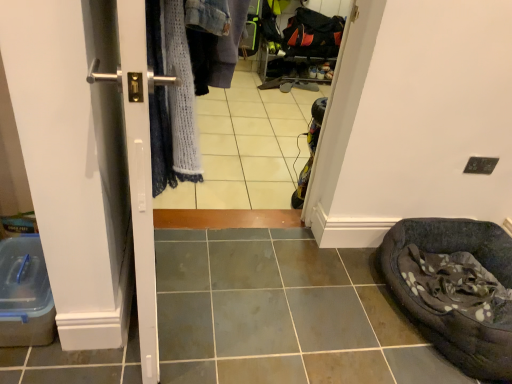
What are the coordinates of `white glossy tile at center` in the screenshot? It's located at (245, 147).

What is the approximate height of satin silver handle at left?

satin silver handle at left is 1.15 meters in height.

Locate an element on the screen. The image size is (512, 384). white glossy tile at center is located at coordinates (245, 147).

Based on the photo, is satin silver handle at left in front of white glossy tile at center?

Yes, the depth of satin silver handle at left is less than that of white glossy tile at center.

Which object is positioned more to the left, satin silver handle at left or white glossy tile at center?

satin silver handle at left.

Would you say white glossy tile at center is part of satin silver handle at left's contents?

That's incorrect, white glossy tile at center is not inside satin silver handle at left.

Considering the sizes of objects satin silver handle at left and white glossy tile at center in the image provided, who is smaller, satin silver handle at left or white glossy tile at center?

white glossy tile at center.

Is white glossy tile at center wider or thinner than satin silver handle at left?

In the image, white glossy tile at center appears to be wider than satin silver handle at left.

Is white glossy tile at center at the left side of satin silver handle at left?

No.

Does point (222, 137) lie in front of point (125, 91)?

No, (222, 137) is further to viewer.

Can you tell me how much white glossy tile at center and satin silver handle at left differ in facing direction?

There is a 0.00164-degree angle between the facing directions of white glossy tile at center and satin silver handle at left.

How different are the orientations of dark gray fabric bean bag at lower right and white glossy tile at center in degrees?

174 degrees.

Does dark gray fabric bean bag at lower right turn towards white glossy tile at center?

No, dark gray fabric bean bag at lower right is not facing towards white glossy tile at center.

From the image's perspective, which one is positioned higher, dark gray fabric bean bag at lower right or white glossy tile at center?

From the image's view, white glossy tile at center is above.

Based on the photo, considering the relative sizes of dark gray fabric bean bag at lower right and white glossy tile at center in the image provided, is dark gray fabric bean bag at lower right shorter than white glossy tile at center?

Correct, dark gray fabric bean bag at lower right is not as tall as white glossy tile at center.

The image size is (512, 384). There is a dark gray fabric bean bag at lower right. Identify the location of screen door above it (from a real-world perspective). (138, 166).

Who is more distant, dark gray fabric bean bag at lower right or satin silver handle at left?

dark gray fabric bean bag at lower right is further away from the camera.

Which of these two, dark gray fabric bean bag at lower right or satin silver handle at left, is smaller?

dark gray fabric bean bag at lower right.

Is dark gray fabric bean bag at lower right at the right side of satin silver handle at left?

Indeed, dark gray fabric bean bag at lower right is positioned on the right side of satin silver handle at left.

Considering the sizes of white glossy tile at center and dark gray fabric bean bag at lower right in the image, is white glossy tile at center taller or shorter than dark gray fabric bean bag at lower right?

white glossy tile at center is taller than dark gray fabric bean bag at lower right.

Between white glossy tile at center and dark gray fabric bean bag at lower right, which one has larger width?

dark gray fabric bean bag at lower right.

I want to click on bean bag chair below the white glossy tile at center (from the image's perspective), so click(x=455, y=289).

From a real-world perspective, is white glossy tile at center located higher than dark gray fabric bean bag at lower right?

Indeed, from a real-world perspective, white glossy tile at center stands above dark gray fabric bean bag at lower right.

From a real-world perspective, who is located higher, satin silver handle at left or dark gray fabric bean bag at lower right?

satin silver handle at left.

What's the angular difference between satin silver handle at left and dark gray fabric bean bag at lower right's facing directions?

satin silver handle at left and dark gray fabric bean bag at lower right are facing 174 degrees away from each other.

Is satin silver handle at left in front of or behind dark gray fabric bean bag at lower right in the image?

Visually, satin silver handle at left is located in front of dark gray fabric bean bag at lower right.

The image size is (512, 384). Identify the location of tile behind the satin silver handle at left. (245, 147).

Image resolution: width=512 pixels, height=384 pixels. I want to click on screen door below the white glossy tile at center (from the image's perspective), so click(138, 166).

From the image, which object appears to be nearer to satin silver handle at left, dark gray fabric bean bag at lower right or white glossy tile at center?

dark gray fabric bean bag at lower right is positioned closer to the anchor satin silver handle at left.

Considering their positions, is dark gray fabric bean bag at lower right positioned further to white glossy tile at center than satin silver handle at left?

satin silver handle at left is positioned further to the anchor white glossy tile at center.

Considering their positions, is satin silver handle at left positioned closer to dark gray fabric bean bag at lower right than white glossy tile at center?

satin silver handle at left is closer to dark gray fabric bean bag at lower right.

Looking at the image, which one is located further to dark gray fabric bean bag at lower right, white glossy tile at center or satin silver handle at left?

white glossy tile at center is positioned further to the anchor dark gray fabric bean bag at lower right.

Estimate the real-world distances between objects in this image. Which object is closer to satin silver handle at left, white glossy tile at center or dark gray fabric bean bag at lower right?

Based on the image, dark gray fabric bean bag at lower right appears to be nearer to satin silver handle at left.

Which object lies further to the anchor point white glossy tile at center, satin silver handle at left or dark gray fabric bean bag at lower right?

satin silver handle at left is positioned further to the anchor white glossy tile at center.

The width and height of the screenshot is (512, 384). I want to click on tile between satin silver handle at left and dark gray fabric bean bag at lower right, so click(x=245, y=147).